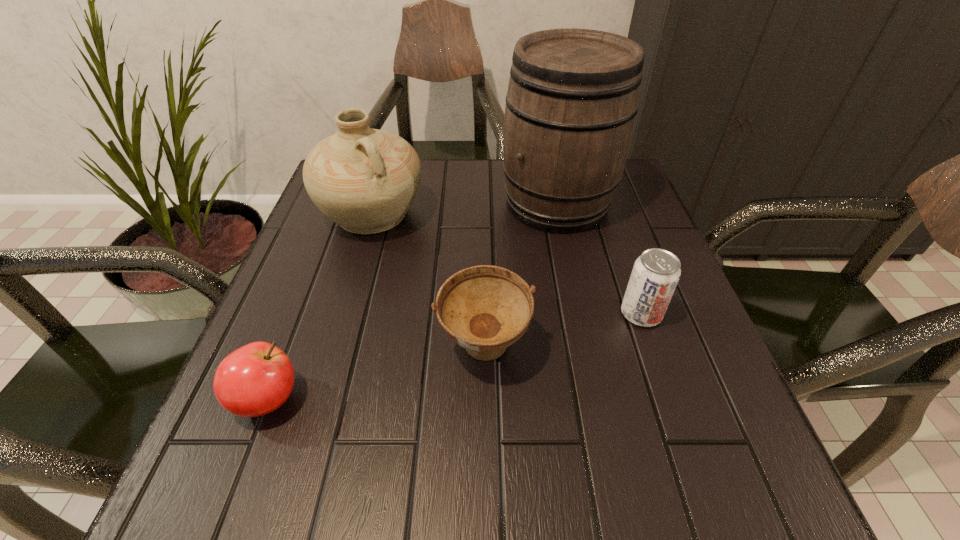
I want to click on empty space that is in between the shortest object and the pottery, so click(320, 307).

Where is `empty location between the shortest object and the soda can`? empty location between the shortest object and the soda can is located at coordinates (454, 356).

I want to click on object identified as the fourth closest to the soda can, so point(256,379).

You are a GUI agent. You are given a task and a screenshot of the screen. Output one action in this format:
    pyautogui.click(x=<x>, y=<y>)
    Task: Click on the object that is the third closest to the soup bowl
    
    Given the screenshot: What is the action you would take?
    pyautogui.click(x=256, y=379)